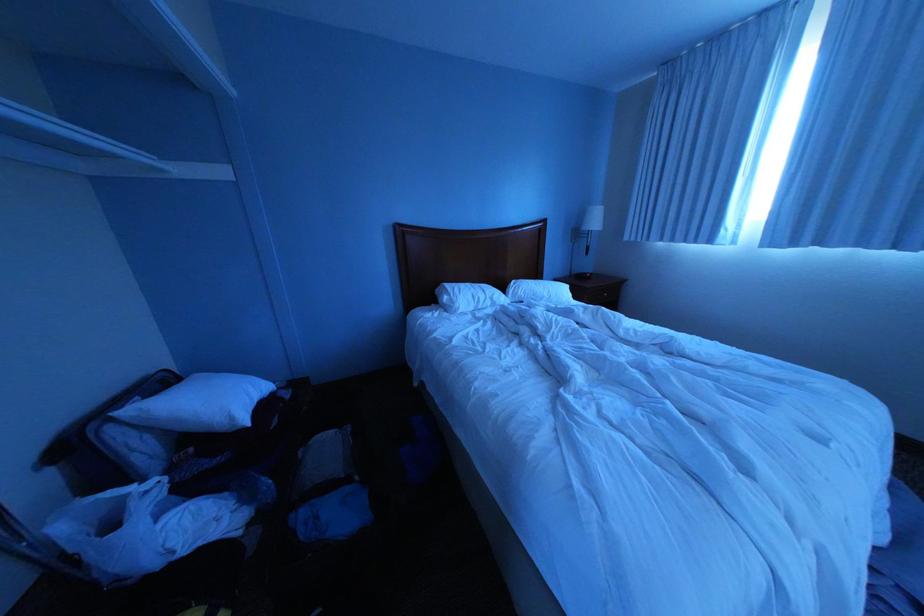
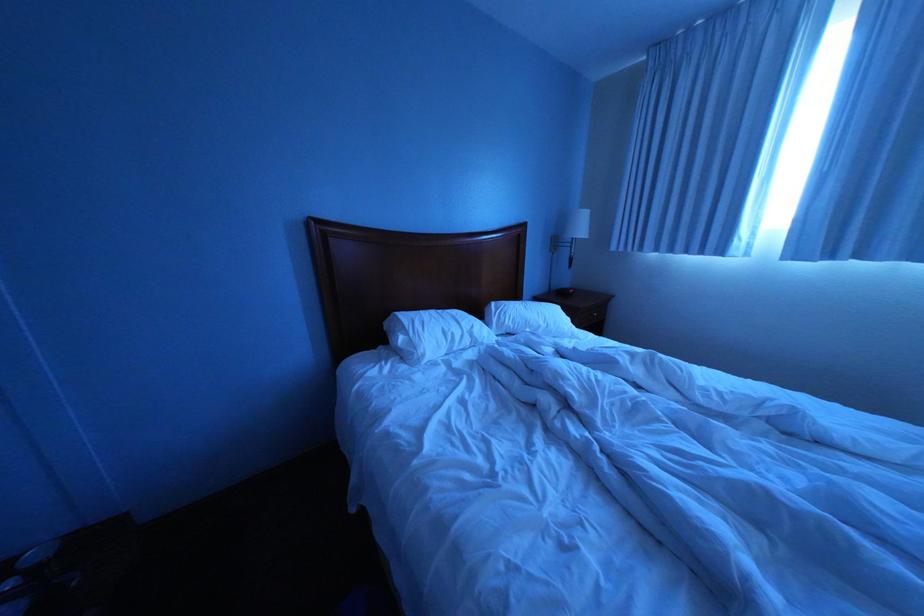
Question: The camera is either moving clockwise (left) or counter-clockwise (right) around the object. The first image is from the beginning of the video and the second image is from the end. Is the camera moving left or right when shooting the video?

Choices:
 (A) Left
 (B) Right

Answer: (A)